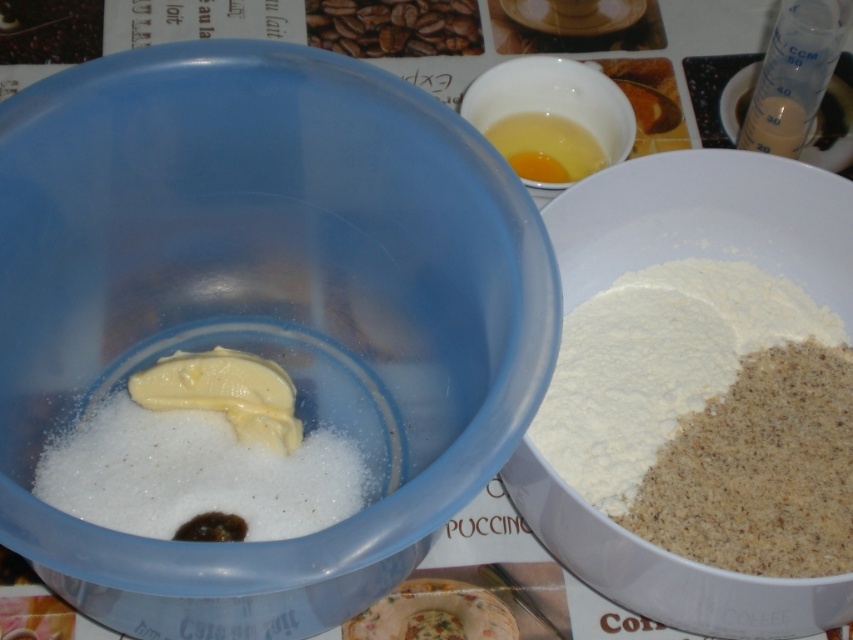
Question: Is white matte bowl at right bigger than white powdery flour at right?

Choices:
 (A) yes
 (B) no

Answer: (A)

Question: Based on their relative distances, which object is farther from the white powdery flour at right?

Choices:
 (A) translucent plastic bowl at center
 (B) translucent glass bowl at upper center
 (C) white matte bowl at right
 (D) yellow liquid at upper center

Answer: (A)

Question: Which is nearer to the translucent plastic bowl at center?

Choices:
 (A) white powdery flour at right
 (B) white matte bowl at right
 (C) yellow liquid at upper center

Answer: (B)

Question: Among these objects, which one is nearest to the camera?

Choices:
 (A) translucent plastic bowl at center
 (B) translucent glass bowl at upper center
 (C) yellow liquid at upper center

Answer: (A)

Question: Is translucent plastic bowl at center further to the viewer compared to white powdery flour at right?

Choices:
 (A) no
 (B) yes

Answer: (A)

Question: Does white matte bowl at right appear on the right side of white powdery flour at right?

Choices:
 (A) no
 (B) yes

Answer: (A)